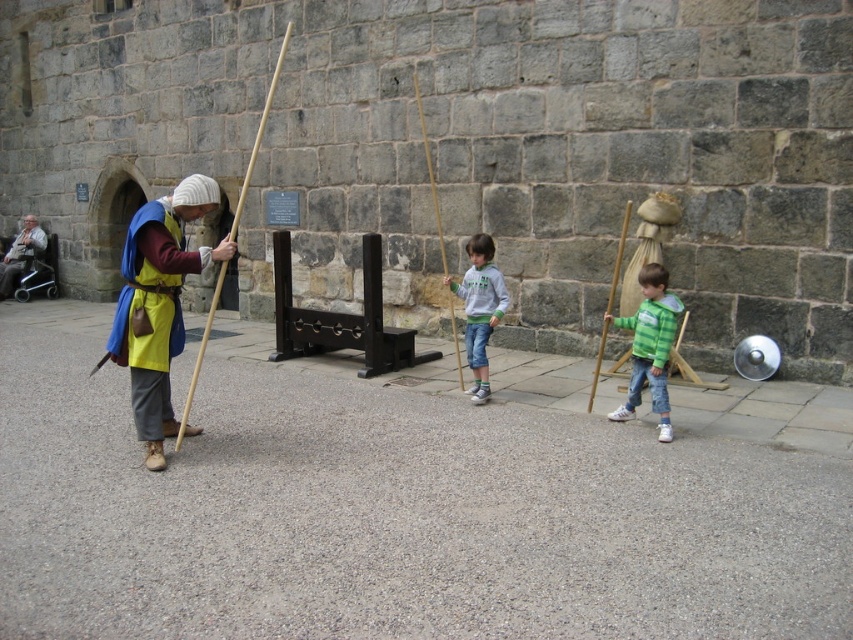
Question: Which point is farther from the camera taking this photo?

Choices:
 (A) (286, 42)
 (B) (651, 364)

Answer: (A)

Question: Among these points, which one is nearest to the camera?

Choices:
 (A) (611, 307)
 (B) (180, 268)

Answer: (B)

Question: Is gray fleece sweater at center positioned in front of brown wooden stick at center?

Choices:
 (A) yes
 (B) no

Answer: (A)

Question: Is gray fleece sweater at center wider than brown wooden stick at center?

Choices:
 (A) yes
 (B) no

Answer: (A)

Question: Which of these objects is positioned farthest from the green textured sweater at center?

Choices:
 (A) wooden staff at left
 (B) brown wooden stick at center
 (C) light brown leather jacket at left
 (D) gray fleece sweater at center

Answer: (C)

Question: Considering the relative positions of wooden staff at left and brown wooden stick at center in the image provided, where is wooden staff at left located with respect to brown wooden stick at center?

Choices:
 (A) below
 (B) above

Answer: (A)